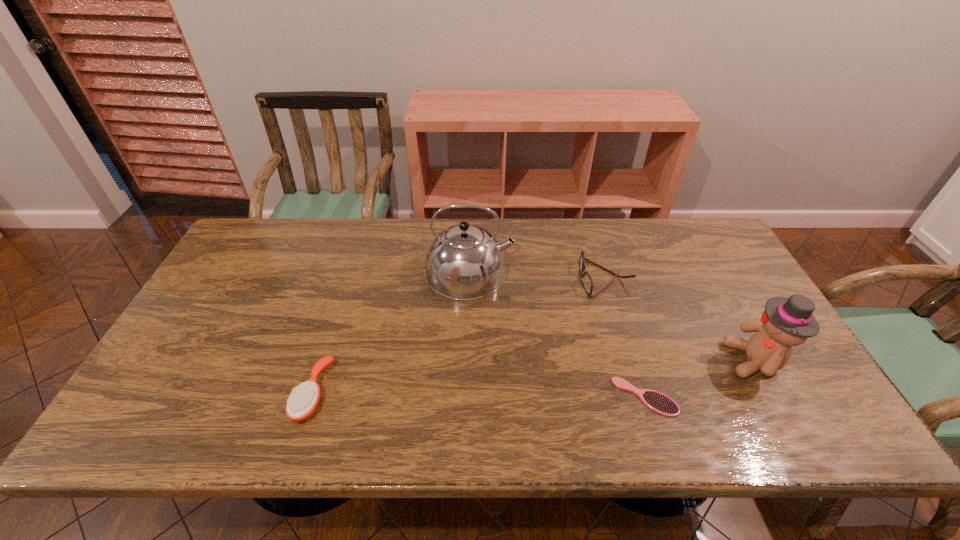
The height and width of the screenshot is (540, 960). Find the location of `vacant area situated 0.200m on the front-facing side of the second tallest object`. vacant area situated 0.200m on the front-facing side of the second tallest object is located at coordinates (648, 360).

This screenshot has height=540, width=960. I want to click on vacant region located on the front-facing side of the second tallest object, so click(x=680, y=360).

Locate an element on the screen. Image resolution: width=960 pixels, height=540 pixels. free location located on the front-facing side of the spectacles is located at coordinates (564, 278).

This screenshot has height=540, width=960. In order to click on vacant space located 0.230m on the front-facing side of the spectacles in this screenshot , I will do `click(504, 278)`.

The width and height of the screenshot is (960, 540). What are the coordinates of `vacant space situated on the front-facing side of the spectacles` in the screenshot? It's located at (527, 278).

Identify the location of vacant area situated 0.250m on the back of the taller hairbrush. (344, 293).

Identify the location of free space located 0.240m on the left of the shorter hairbrush. (513, 397).

This screenshot has width=960, height=540. I want to click on kettle present at the far edge, so (464, 262).

Where is `spectacles located at the far edge`? spectacles located at the far edge is located at coordinates (587, 282).

At what (x,y) coordinates should I click in order to perform the action: click on object located in the right edge section of the desktop. Please return your answer as a coordinate pair (x, y). Looking at the image, I should click on (786, 322).